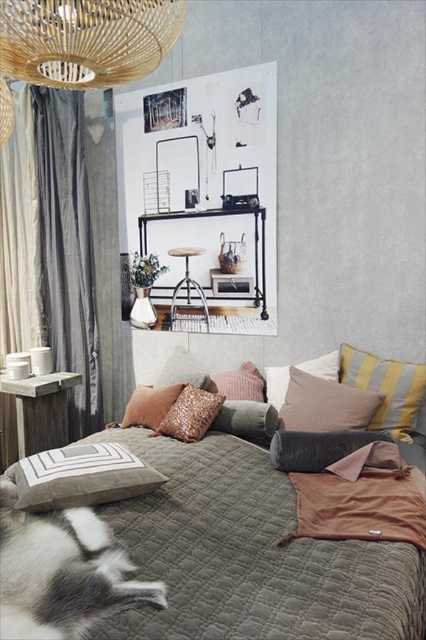
Question: Which of the following is the farthest from the observer?

Choices:
 (A) (164, 417)
 (B) (69, 288)

Answer: (B)

Question: Considering the relative positions of quilted fabric bed at center and shiny gold pillow at center in the image provided, where is quilted fabric bed at center located with respect to shiny gold pillow at center?

Choices:
 (A) below
 (B) above

Answer: (A)

Question: Which object is the farthest from the bamboo chandelier at upper left?

Choices:
 (A) leopard print cushion at center
 (B) gray fabric curtain at left

Answer: (B)

Question: From the image, what is the correct spatial relationship of matte brown pillow at center in relation to leopard print cushion at center?

Choices:
 (A) below
 (B) above

Answer: (B)

Question: Which point is farther to the camera?

Choices:
 (A) (313, 374)
 (B) (16, 480)
 (C) (161, 419)

Answer: (C)

Question: Does textured gray pillow at center have a larger size compared to shiny gold pillow at center?

Choices:
 (A) no
 (B) yes

Answer: (B)